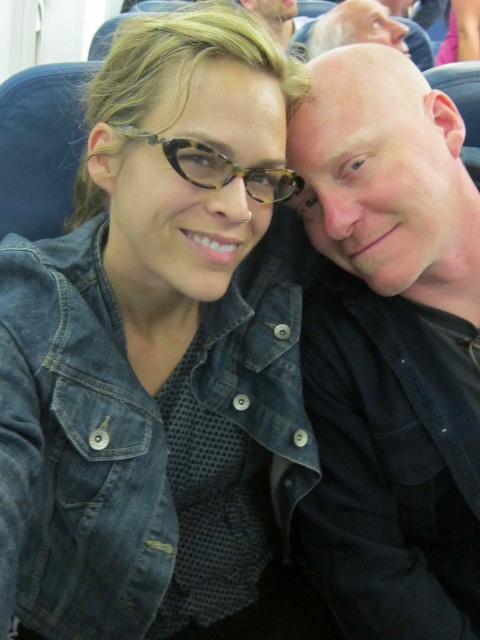
Question: Which point appears closest to the camera in this image?

Choices:
 (A) (240, 168)
 (B) (440, 579)
 (C) (187, 593)
 (D) (384, 20)

Answer: (A)

Question: Which object is positioned farthest from the black matte shirt at right?

Choices:
 (A) tortoiseshell glasses at upper center
 (B) faded denim jacket at lower right
 (C) bald head at upper center

Answer: (C)

Question: Which is nearer to the tortoiseshell glasses at upper center?

Choices:
 (A) faded denim jacket at lower right
 (B) bald head at upper center
 (C) black matte shirt at right

Answer: (C)

Question: Is black matte shirt at right further to camera compared to tortoiseshell glasses at upper center?

Choices:
 (A) no
 (B) yes

Answer: (B)

Question: Is black matte shirt at right wider than tortoiseshell glasses at upper center?

Choices:
 (A) yes
 (B) no

Answer: (A)

Question: Is the position of faded denim jacket at lower right less distant than that of bald head at upper center?

Choices:
 (A) no
 (B) yes

Answer: (B)